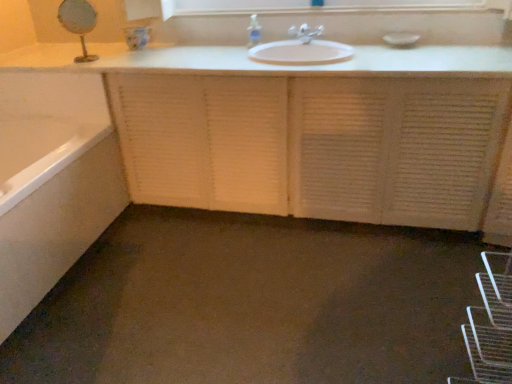
You are a GUI agent. You are given a task and a screenshot of the screen. Output one action in this format:
    pyautogui.click(x=<x>, y=<y>)
    Task: Click on the vacant space behind matte white faucet at center
    
    Given the screenshot: What is the action you would take?
    pyautogui.click(x=298, y=36)